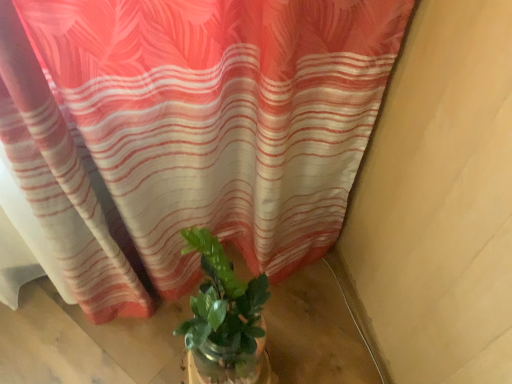
Find the location of a particular element. The height and width of the screenshot is (384, 512). green leafy plant in glass jar at center is located at coordinates (224, 317).

What is the approximate width of green leafy plant in glass jar at center?

It is 8.12 inches.

Describe the element at coordinates (224, 317) in the screenshot. This screenshot has width=512, height=384. I see `green leafy plant in glass jar at center` at that location.

This screenshot has width=512, height=384. I want to click on green leafy plant in glass jar at center, so click(x=224, y=317).